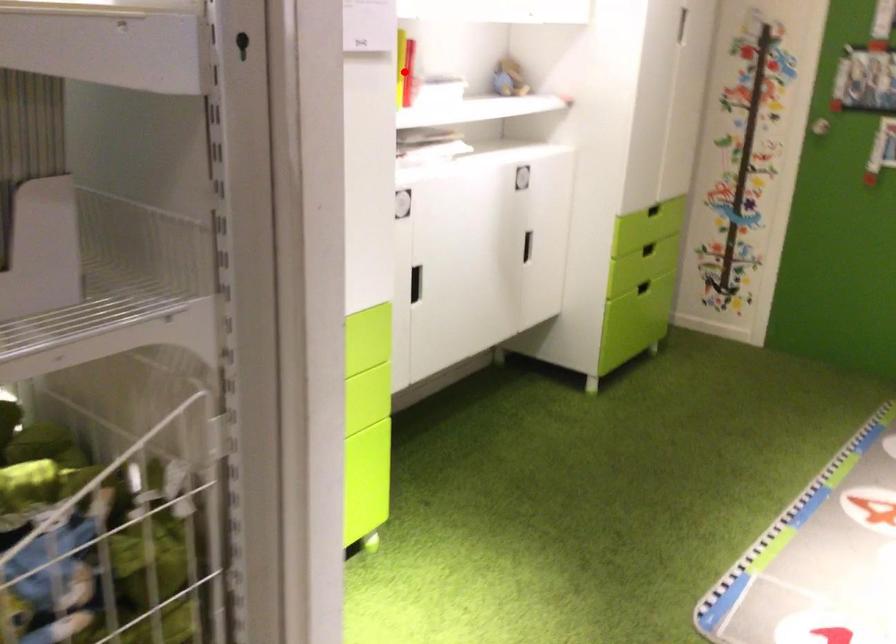
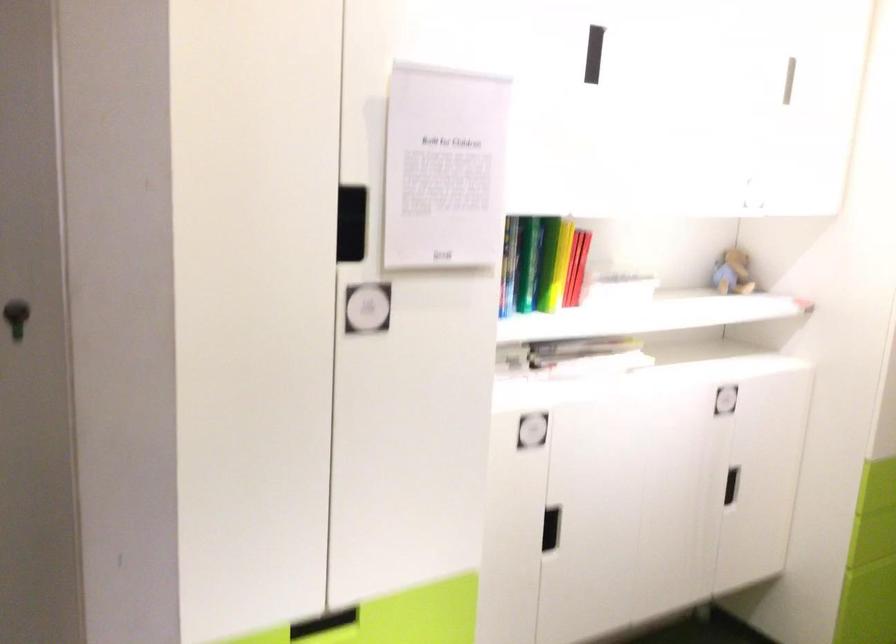
Locate, in the second image, the point that corresponds to the highlighted location in the first image.

(576, 267)